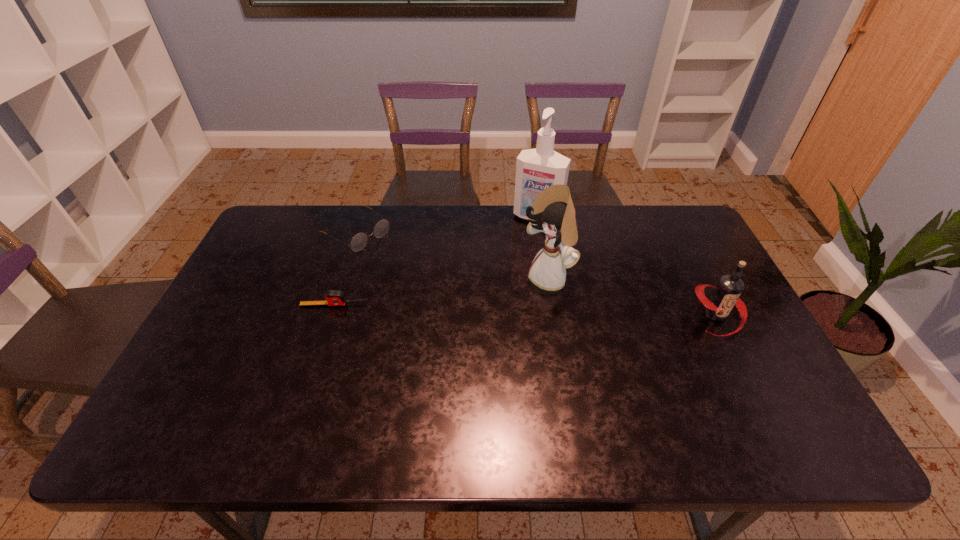
Image resolution: width=960 pixels, height=540 pixels. Find the location of `vacant space located 0.190m on the front label of the cleansing agent`. vacant space located 0.190m on the front label of the cleansing agent is located at coordinates (511, 261).

Find the location of a particular element. The image size is (960, 540). vacant space situated at the front face of the doll is located at coordinates (416, 339).

Locate an element on the screen. free location located at the front face of the doll is located at coordinates (503, 301).

Locate an element on the screen. The image size is (960, 540). free space located at the front face of the doll is located at coordinates (426, 334).

Where is `free space located on the temples of the spectacles`? This screenshot has height=540, width=960. free space located on the temples of the spectacles is located at coordinates (417, 273).

Locate an element on the screen. This screenshot has height=540, width=960. vacant region located on the temples of the spectacles is located at coordinates (397, 260).

Image resolution: width=960 pixels, height=540 pixels. Find the location of `free space located on the temples of the spectacles`. free space located on the temples of the spectacles is located at coordinates (447, 293).

The width and height of the screenshot is (960, 540). What are the coordinates of `cleansing agent present at the far edge` in the screenshot? It's located at (537, 169).

The image size is (960, 540). I want to click on spectacles located at the far edge, so click(359, 241).

Where is `object that is at the right edge`? Image resolution: width=960 pixels, height=540 pixels. object that is at the right edge is located at coordinates click(726, 294).